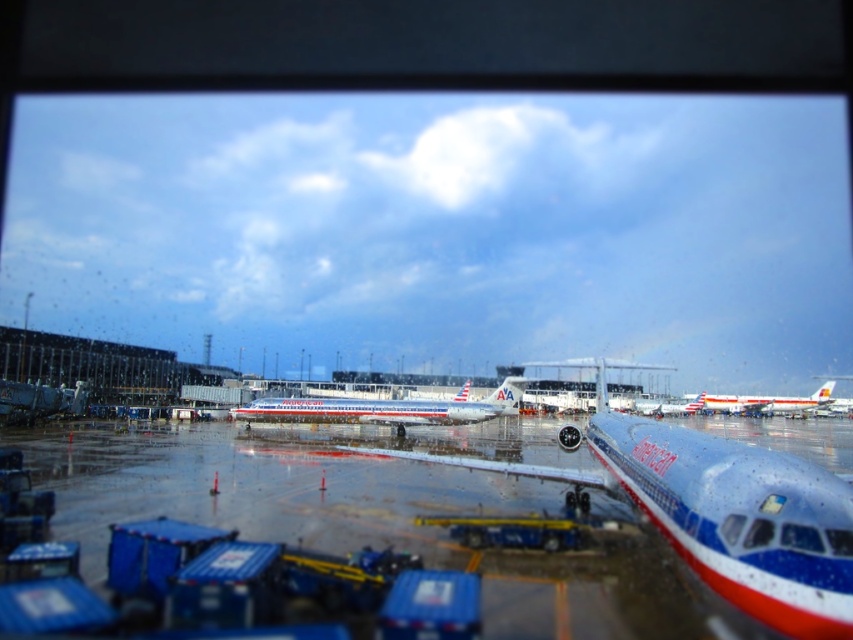
Question: Is silver metallic airplane at center smaller than white glossy airplane at center?

Choices:
 (A) yes
 (B) no

Answer: (B)

Question: Which point is farther to the camera?

Choices:
 (A) click(256, 403)
 (B) click(759, 397)

Answer: (B)

Question: Is silver metallic airplane at center bigger than white glossy airplane at center?

Choices:
 (A) no
 (B) yes

Answer: (B)

Question: Among these points, which one is nearest to the camera?

Choices:
 (A) (741, 403)
 (B) (299, 400)

Answer: (B)

Question: Is silver metallic airplane at center positioned before white glossy airplane at center?

Choices:
 (A) yes
 (B) no

Answer: (A)